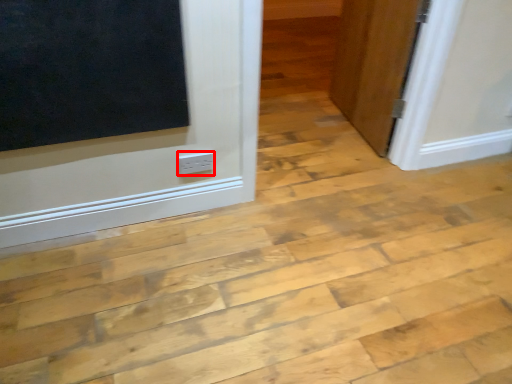
Question: From the image, what is the correct spatial relationship of electric outlet (annotated by the red box) in relation to door?

Choices:
 (A) left
 (B) right

Answer: (A)